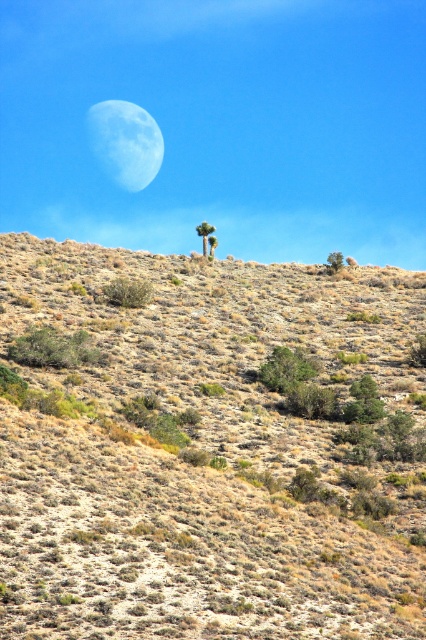
Question: Which of the following is the closest to the observer?

Choices:
 (A) light blue textured moon at upper center
 (B) dry shrubbery at center

Answer: (B)

Question: Does dry shrubbery at center appear under light blue textured moon at upper center?

Choices:
 (A) yes
 (B) no

Answer: (A)

Question: Is dry shrubbery at center to the left of light blue textured moon at upper center from the viewer's perspective?

Choices:
 (A) yes
 (B) no

Answer: (B)

Question: Which object appears farthest from the camera in this image?

Choices:
 (A) light blue textured moon at upper center
 (B) dry shrubbery at center

Answer: (A)

Question: Can you confirm if dry shrubbery at center is positioned to the left of light blue textured moon at upper center?

Choices:
 (A) yes
 (B) no

Answer: (B)

Question: Which point is farther to the camera?

Choices:
 (A) light blue textured moon at upper center
 (B) dry shrubbery at center

Answer: (A)